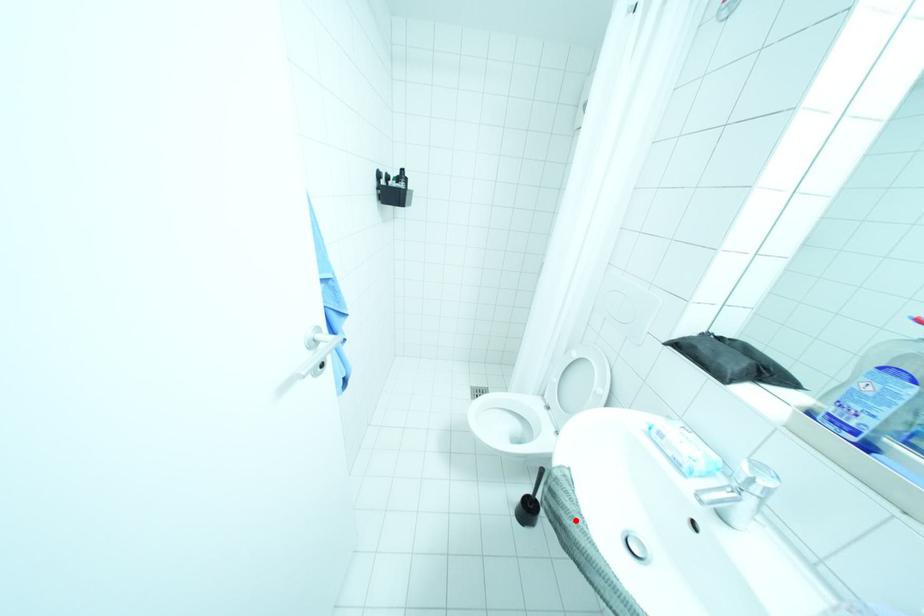
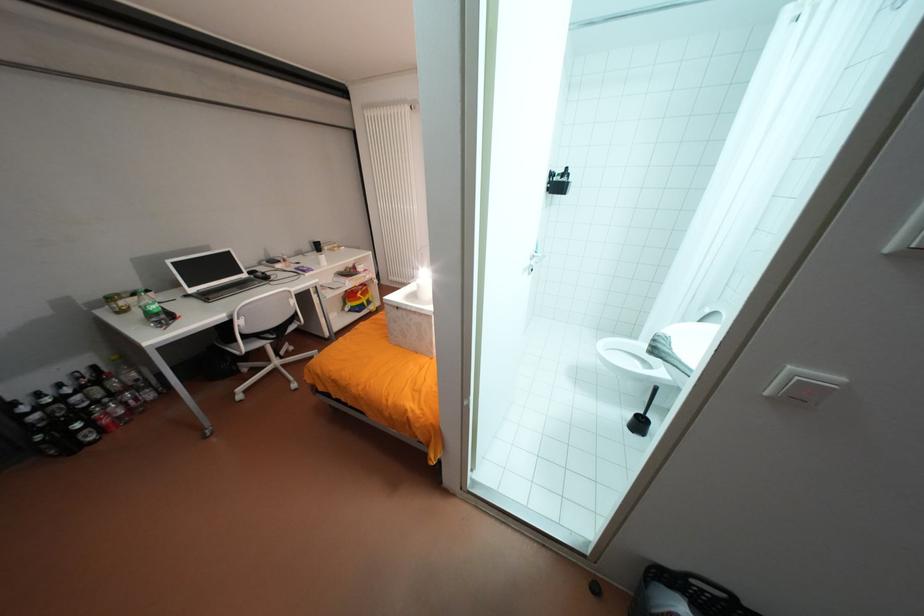
Locate, in the second image, the point that corresponds to the highlighted location in the first image.

(669, 345)